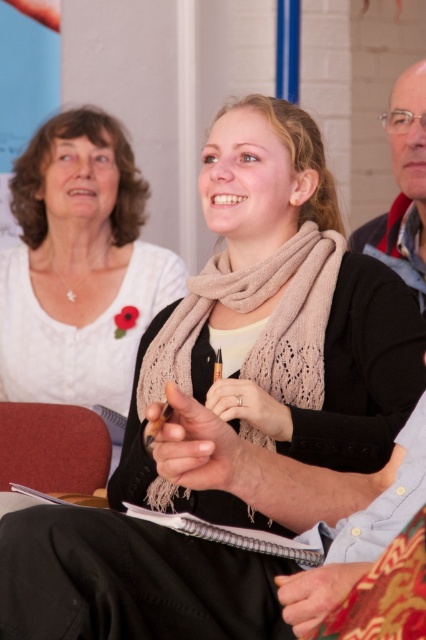
Can you confirm if velvet-like brown chair at lower left is positioned to the left of matte black sweater at upper right?

Indeed, velvet-like brown chair at lower left is positioned on the left side of matte black sweater at upper right.

Can you confirm if velvet-like brown chair at lower left is positioned below matte black sweater at upper right?

Indeed, velvet-like brown chair at lower left is positioned under matte black sweater at upper right.

Is point (74, 435) less distant than point (400, 269)?

That is True.

At what (x,y) coordinates should I click in order to perform the action: click on velvet-like brown chair at lower left. Please return your answer as a coordinate pair (x, y). Looking at the image, I should click on (52, 448).

Is point (291, 240) behind point (414, 285)?

No.

Which is above, knitted beige scarf at center or matte black sweater at upper right?

matte black sweater at upper right is above.

Which is behind, point (317, 273) or point (409, 148)?

The point (409, 148) is behind.

I want to click on knitted beige scarf at center, so click(265, 324).

Can you confirm if white knitted scarf at upper center is smaller than knitted beige scarf at center?

No.

Based on the photo, is white knitted scarf at upper center positioned in front of knitted beige scarf at center?

No, white knitted scarf at upper center is further to the viewer.

Locate an element on the screen. white knitted scarf at upper center is located at coordinates (78, 266).